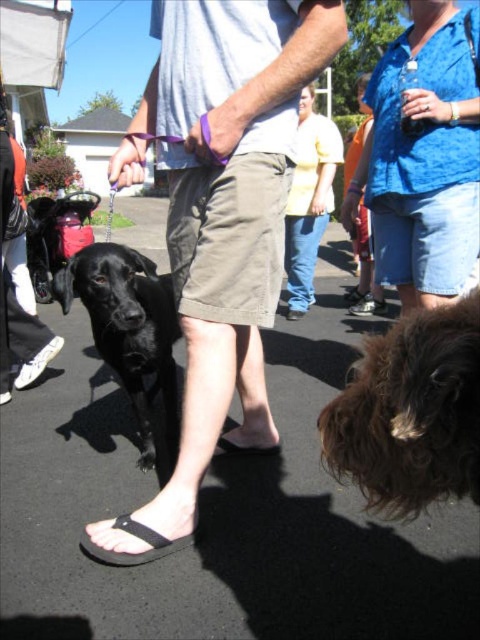
Does black matte shorts at center have a greater height compared to black rubber sandal at lower center?

Correct, black matte shorts at center is much taller as black rubber sandal at lower center.

Describe the element at coordinates (224, 200) in the screenshot. This screenshot has width=480, height=640. I see `black matte shorts at center` at that location.

The image size is (480, 640). In order to click on black matte shorts at center in this screenshot , I will do `click(224, 200)`.

Does yellow cotton shirt at center have a smaller size compared to black rubber sandal at lower center?

Incorrect, yellow cotton shirt at center is not smaller in size than black rubber sandal at lower center.

Is point (312, 218) positioned in front of point (226, 452)?

That is False.

Find the location of `yellow cotton shirt at center`. yellow cotton shirt at center is located at coordinates (309, 200).

Can you confirm if shiny black dog at lower left is wider than black flip-flop at lower center?

Yes, shiny black dog at lower left is wider than black flip-flop at lower center.

Looking at this image, who is lower down, shiny black dog at lower left or black flip-flop at lower center?

Positioned lower is black flip-flop at lower center.

Measure the distance between point (x=120, y=317) and camera.

Point (x=120, y=317) is 5.60 feet from camera.

Locate an element on the screen. shiny black dog at lower left is located at coordinates (129, 328).